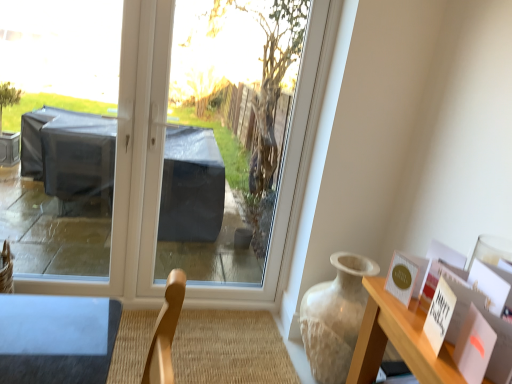
Question: From a real-world perspective, is transparent plastic at center beneath matte gold postcard at upper right?

Choices:
 (A) no
 (B) yes

Answer: (A)

Question: Does transparent plastic at center have a larger size compared to matte gold postcard at upper right?

Choices:
 (A) no
 (B) yes

Answer: (B)

Question: Is transparent plastic at center outside of matte gold postcard at upper right?

Choices:
 (A) yes
 (B) no

Answer: (A)

Question: Are transparent plastic at center and matte gold postcard at upper right beside each other?

Choices:
 (A) yes
 (B) no

Answer: (B)

Question: Considering the relative positions of transparent plastic at center and matte gold postcard at upper right in the image provided, is transparent plastic at center to the left of matte gold postcard at upper right from the viewer's perspective?

Choices:
 (A) yes
 (B) no

Answer: (A)

Question: Considering their positions, is matte gold postcard at upper right located in front of or behind transparent plastic at center?

Choices:
 (A) front
 (B) behind

Answer: (A)

Question: In terms of width, does matte gold postcard at upper right look wider or thinner when compared to transparent plastic at center?

Choices:
 (A) wide
 (B) thin

Answer: (A)

Question: In the image, is matte gold postcard at upper right on the left side or the right side of transparent plastic at center?

Choices:
 (A) right
 (B) left

Answer: (A)

Question: Is matte gold postcard at upper right spatially inside transparent plastic at center, or outside of it?

Choices:
 (A) outside
 (B) inside

Answer: (A)

Question: From the image's perspective, relative to transparent plastic at center, is transparent plastic window screen at center above or below?

Choices:
 (A) above
 (B) below

Answer: (B)

Question: In terms of size, does transparent plastic window screen at center appear bigger or smaller than transparent plastic at center?

Choices:
 (A) big
 (B) small

Answer: (A)

Question: From a real-world perspective, is transparent plastic window screen at center above or below transparent plastic at center?

Choices:
 (A) below
 (B) above

Answer: (B)

Question: Which is correct: transparent plastic window screen at center is inside transparent plastic at center, or outside of it?

Choices:
 (A) inside
 (B) outside

Answer: (A)

Question: Does point (314, 292) appear closer or farther from the camera than point (140, 87)?

Choices:
 (A) farther
 (B) closer

Answer: (A)

Question: In terms of size, does matte beige vase at right appear bigger or smaller than transparent plastic at center?

Choices:
 (A) big
 (B) small

Answer: (B)